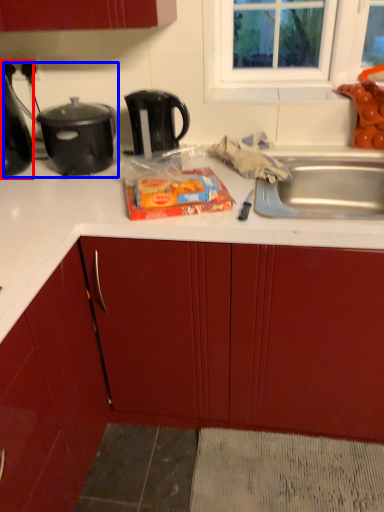
Question: Which object appears closest to the camera in this image, kitchen appliance (highlighted by a red box) or appliance (highlighted by a blue box)?

Choices:
 (A) kitchen appliance
 (B) appliance

Answer: (A)